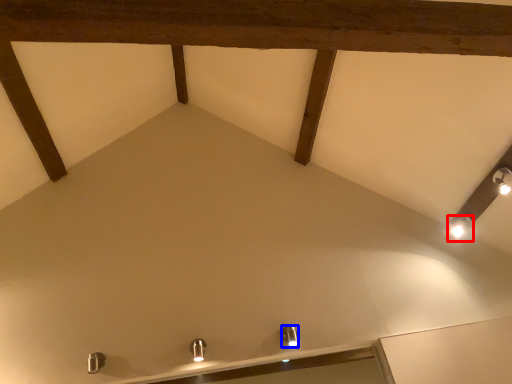
Question: Which of the following is the closest to the observer, light fixture (highlighted by a red box) or light fixture (highlighted by a blue box)?

Choices:
 (A) light fixture
 (B) light fixture

Answer: (B)